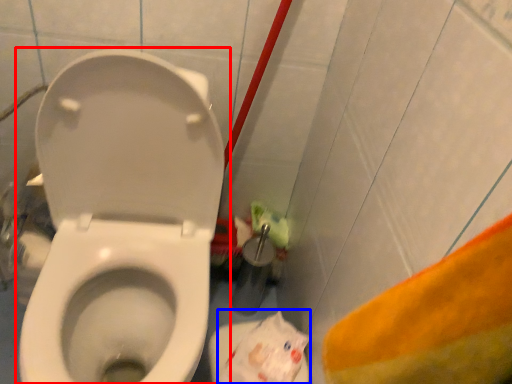
Question: Which of the following is the closest to the observer, toilet (highlighted by a red box) or paper bag (highlighted by a blue box)?

Choices:
 (A) toilet
 (B) paper bag

Answer: (A)